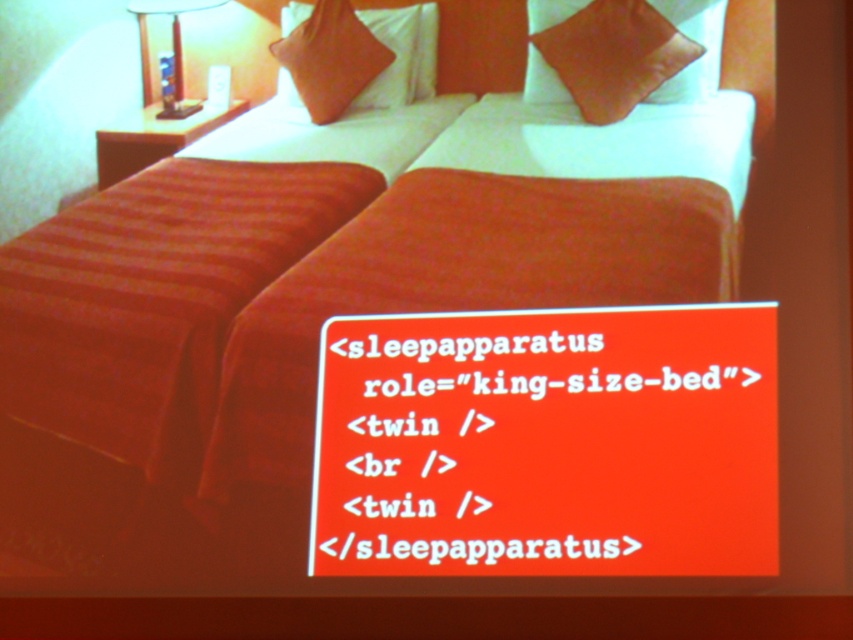
You are trying to place a new decorative item on the bed. The satin orange pillow at upper right and the orange fabric pillow at upper center are already there. Which pillow should you place the new item on top of to ensure it is visible?

The satin orange pillow at upper right is in front of the orange fabric pillow at upper center, so placing the new item on the orange fabric pillow at upper center will ensure it is visible above both pillows.

You are trying to place a new decorative item on the bed. The item is the size of the orange fabric pillow at upper center. Where can you place it without overlapping the matte white lamp at upper left?

Since the orange fabric pillow at upper center occupies less space than the matte white lamp at upper left, you can place the new item near the orange fabric pillow at upper center without overlapping the matte white lamp at upper left.

You are standing at the foot of the king size bed and want to place a small decorative item on the nightstand next to the bed. The nightstand has two spots marked by points at coordinates point (x=410, y=36) and point (x=157, y=1). Which point should you place the item on to ensure it is closer to you?

The point (x=410, y=36) is in front of point (x=157, y=1), so placing the item on point (x=410, y=36) will be closer to you.